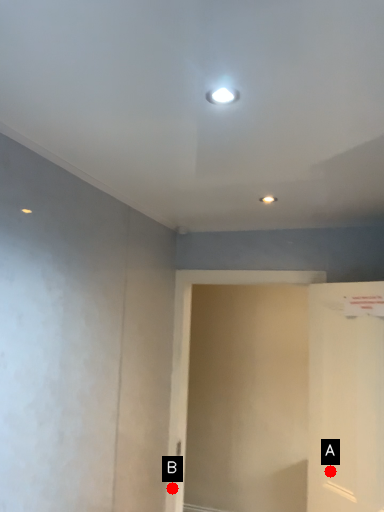
Question: Two points are circled on the image, labeled by A and B beside each circle. Which point appears farthest from the camera in this image?

Choices:
 (A) A is further
 (B) B is further

Answer: (B)